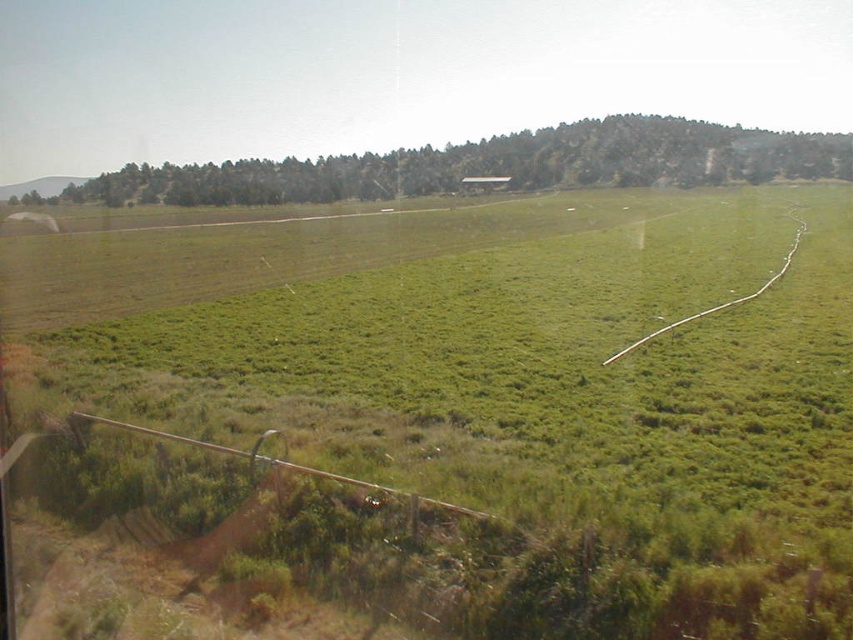
Who is lower down, green grassy field at center or green grassy hillside at upper center?

green grassy field at center

Is green grassy field at center to the left of green grassy hillside at upper center from the viewer's perspective?

No, green grassy field at center is not to the left of green grassy hillside at upper center.

Measure the distance between green grassy field at center and camera.

A distance of 15.73 feet exists between green grassy field at center and camera.

This screenshot has width=853, height=640. Identify the location of green grassy field at center. (439, 422).